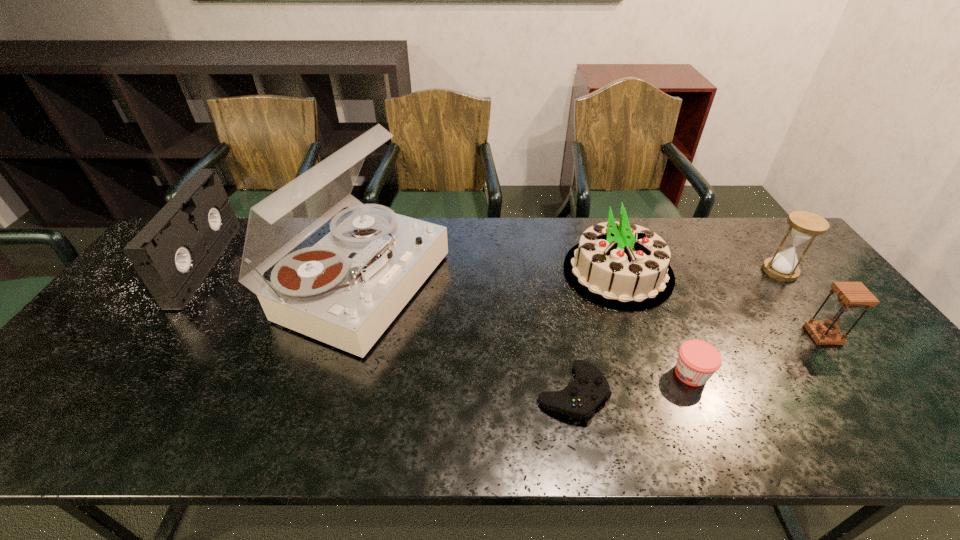
In order to click on free space that satisfies the following two spatial constraints: 1. on the side of the videotape with visible spindles; 2. on the left side of the tallest object in this screenshot , I will do `click(192, 284)`.

What are the coordinates of `vacant space that satisfies the following two spatial constraints: 1. on the side of the videotape with visible spindles; 2. on the right side of the tallest object` in the screenshot? It's located at tap(192, 284).